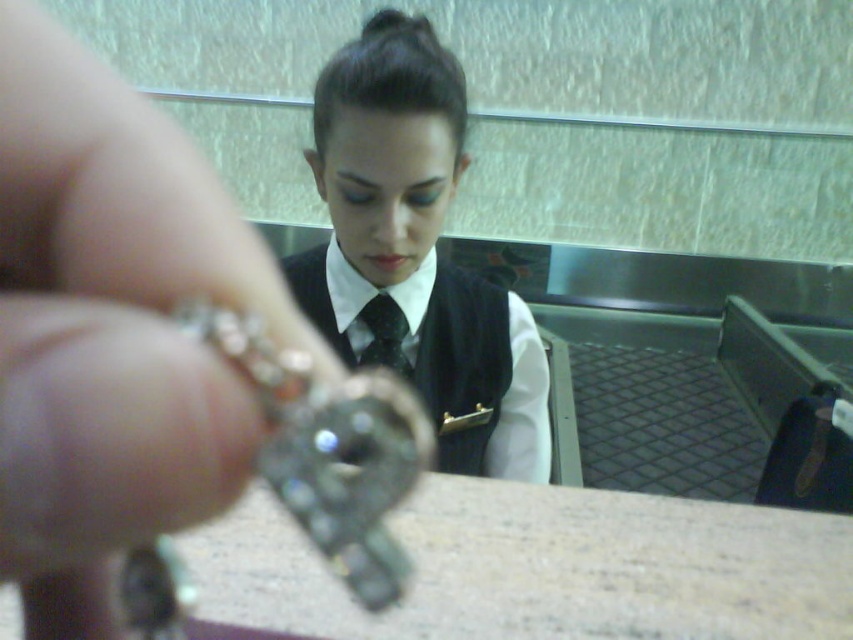
Is point (340, 371) behind point (498, 472)?

No.

Consider the image. Can you confirm if silver metallic ring at upper left is smaller than black satin vest at center?

Indeed, silver metallic ring at upper left has a smaller size compared to black satin vest at center.

Does point (0, 212) come behind point (291, 285)?

No.

This screenshot has width=853, height=640. Identify the location of silver metallic ring at upper left. (112, 310).